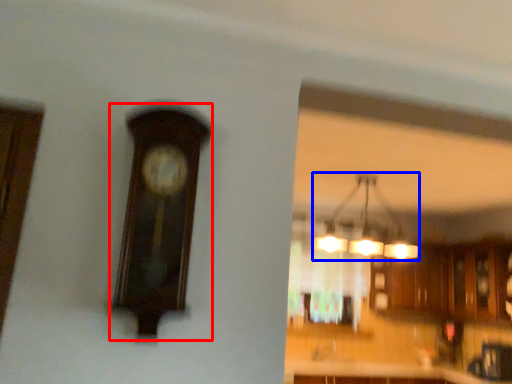
Question: Among these objects, which one is nearest to the camera, clock (highlighted by a red box) or lamp (highlighted by a blue box)?

Choices:
 (A) clock
 (B) lamp

Answer: (A)